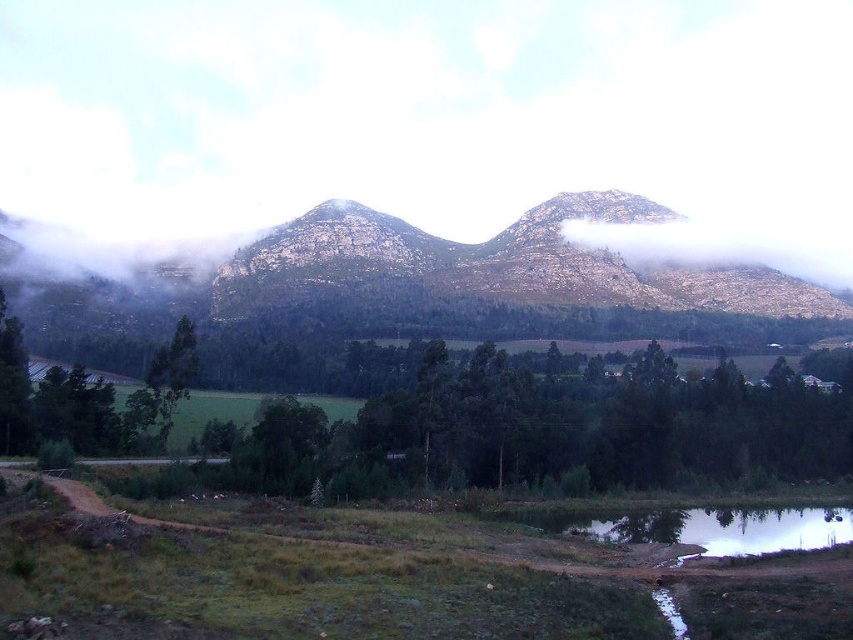
You are an environmental scientist assessing the landscape. You need to determine which object, the green leafy trees at center or the rugged stone mountain at center, occupies a larger area in the scene. Based on the provided information, which one is bigger?

The rugged stone mountain at center is larger than the green leafy trees at center.

You are standing in the landscape and want to take a photo of the green leafy trees at center and the smooth reflective water at bottom right. Which object should you frame first in your camera viewfinder to ensure both are in the shot?

You should frame the green leafy trees at center first because they are positioned to the left of the smooth reflective water at bottom right, so starting with the trees ensures the water will also be captured in the frame.

You are an artist wanting to paint the landscape. You notice the green leafy trees at center and the smooth reflective water at bottom right. Which object should you paint first if you want to depict them in their correct spatial relationship, considering their sizes?

You should paint the green leafy trees at center first because they are larger and likely closer to the foreground, establishing the main elements before adding the smaller smooth reflective water at bottom right in the background.